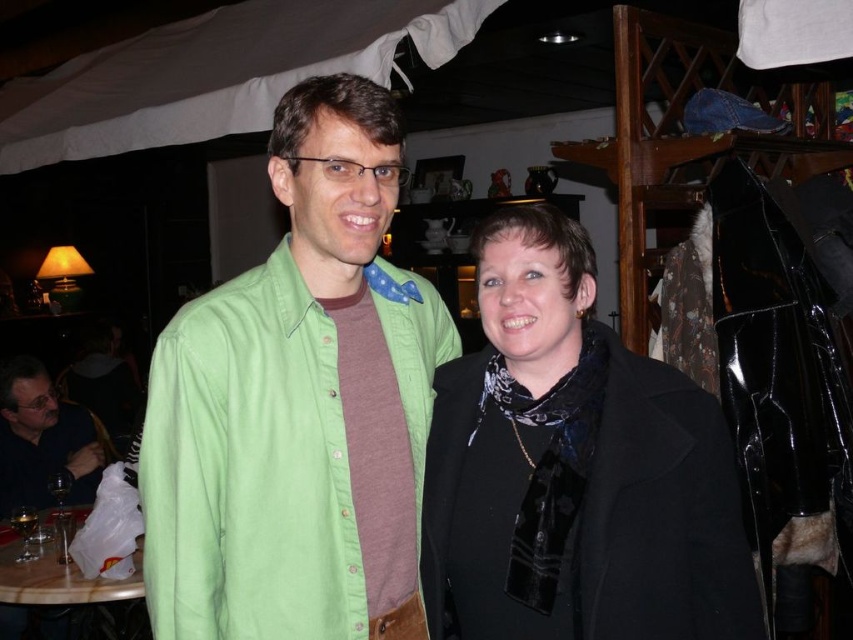
You are standing in the room and want to place a decorative item on the table. The green cotton shirt at center is in your way. Can you move the shirt to the left to make space?

The green cotton shirt at center is located at point [299,404], so you can move it to the left to make space on the table.

You are a fashion designer who wants to hang both the black matte coat at center and the matte black jacket at lower left on a rack. The rack has a height limit of 1.2 meters. If the jacket is 0.8 meters tall, will both items fit on the rack?

The black matte coat at center is taller than the matte black jacket at lower left, which is 0.8 meters. Since the coat is taller than the jacket, it must be over 0.8 meters. If the rack has a 1.2 meters height limit, the jacket will fit, but the coat might exceed the limit depending on its exact height. However, without knowing the exact height of the coat, we cannot confirm if it will fit.

You are a photographer setting up for a group photo. You want to ensure that the green cotton shirt at center and the black matte coat at center are both clearly visible in the frame. Given their current distance apart, is there enough space between them to focus on each individually without overlapping?

The green cotton shirt at center is 25.51 centimeters from the black matte coat at center. Since this distance allows for clear separation between the two objects, the photographer can focus on each individually without overlapping.